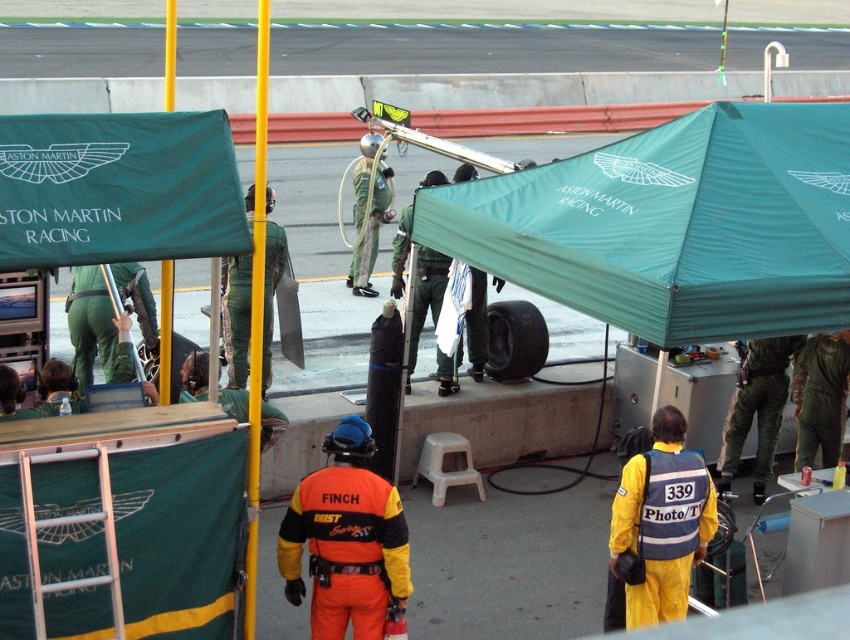
What is located at the point with coordinates (673, 225)?

The point at (673, 225) has the green fabric canopy at upper center.